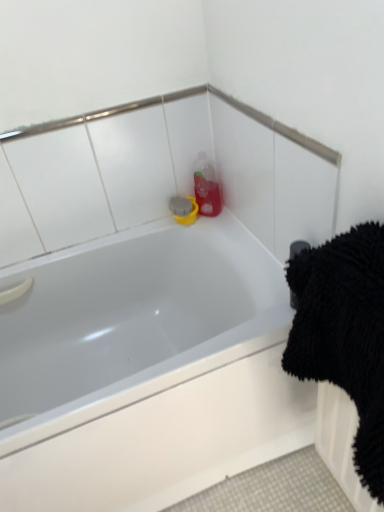
Question: Is the depth of black rubber towel bar at upper right greater than that of white glossy bathtub at upper center?

Choices:
 (A) no
 (B) yes

Answer: (B)

Question: From a real-world perspective, is black rubber towel bar at upper right positioned over white glossy bathtub at upper center based on gravity?

Choices:
 (A) yes
 (B) no

Answer: (A)

Question: Is black rubber towel bar at upper right oriented away from white glossy bathtub at upper center?

Choices:
 (A) yes
 (B) no

Answer: (B)

Question: From the image's perspective, does black rubber towel bar at upper right appear lower than white glossy bathtub at upper center?

Choices:
 (A) no
 (B) yes

Answer: (A)

Question: Is black rubber towel bar at upper right next to white glossy bathtub at upper center and touching it?

Choices:
 (A) yes
 (B) no

Answer: (B)

Question: Considering the positions of black fluffy bath towel at right and black rubber towel bar at upper right in the image, is black fluffy bath towel at right bigger or smaller than black rubber towel bar at upper right?

Choices:
 (A) small
 (B) big

Answer: (B)

Question: Considering the positions of black fluffy bath towel at right and black rubber towel bar at upper right in the image, is black fluffy bath towel at right taller or shorter than black rubber towel bar at upper right?

Choices:
 (A) short
 (B) tall

Answer: (B)

Question: From the image's perspective, is black fluffy bath towel at right positioned above or below black rubber towel bar at upper right?

Choices:
 (A) above
 (B) below

Answer: (B)

Question: Relative to black rubber towel bar at upper right, is black fluffy bath towel at right in front or behind?

Choices:
 (A) behind
 (B) front

Answer: (B)

Question: From a real-world perspective, is white glossy bathtub at upper center positioned above or below black fluffy bath towel at right?

Choices:
 (A) above
 (B) below

Answer: (B)

Question: Is white glossy bathtub at upper center in front of or behind black fluffy bath towel at right in the image?

Choices:
 (A) front
 (B) behind

Answer: (B)

Question: From the image's perspective, is white glossy bathtub at upper center located above or below black fluffy bath towel at right?

Choices:
 (A) below
 (B) above

Answer: (A)

Question: In terms of width, does white glossy bathtub at upper center look wider or thinner when compared to black fluffy bath towel at right?

Choices:
 (A) thin
 (B) wide

Answer: (B)

Question: From a real-world perspective, is white glossy bathtub at upper center above or below black rubber towel bar at upper right?

Choices:
 (A) below
 (B) above

Answer: (A)

Question: From the image's perspective, is white glossy bathtub at upper center positioned above or below black rubber towel bar at upper right?

Choices:
 (A) above
 (B) below

Answer: (B)